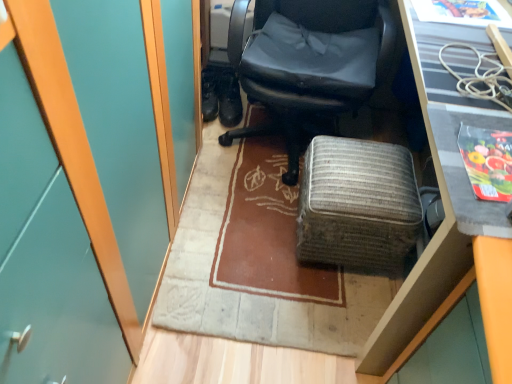
Locate an element on the screen. free point above woven fabric ottoman at center (from a real-world perspective) is located at coordinates (362, 167).